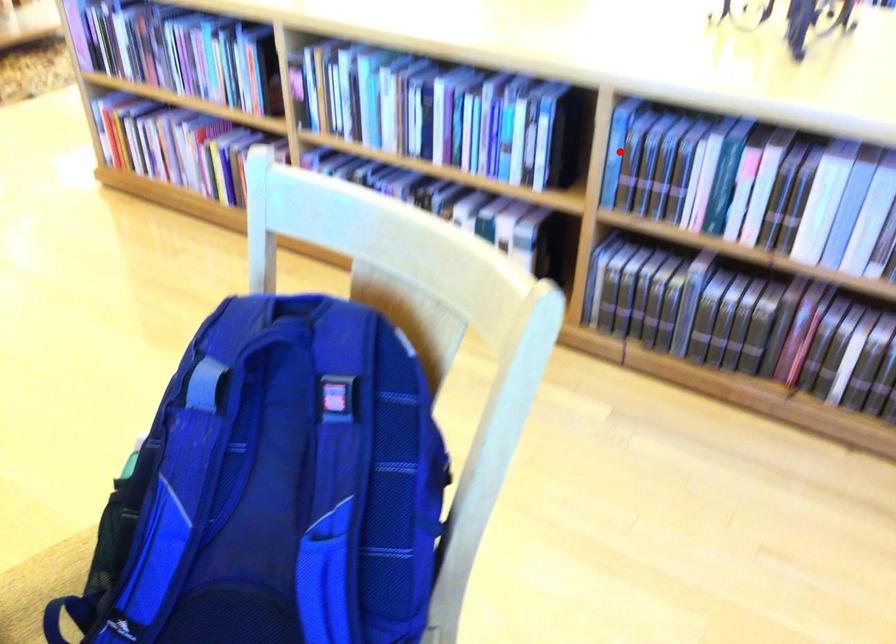
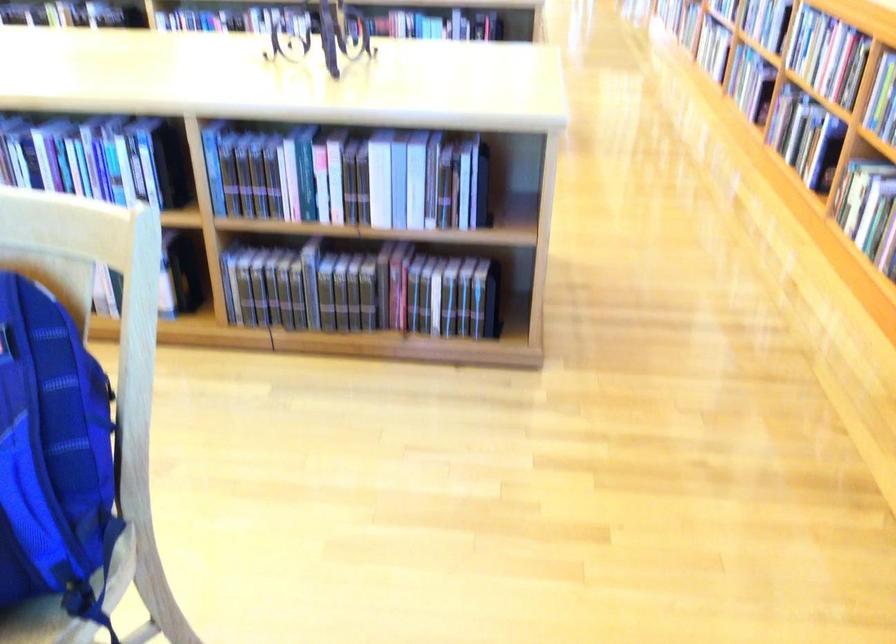
In the second image, find the point that corresponds to the highlighted location in the first image.

(213, 164)